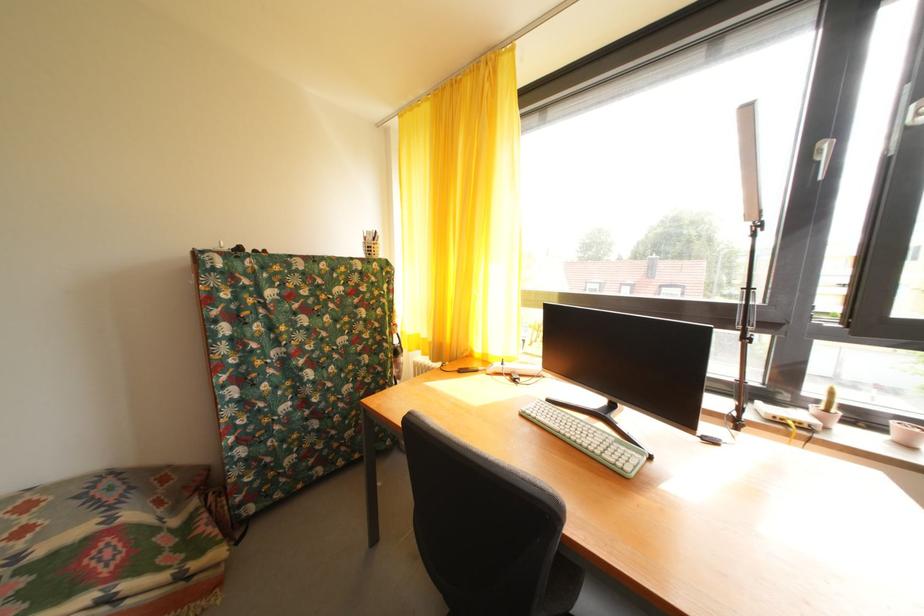
At what (x,y) coordinates should I click in order to perform the action: click on white router. Please return your answer as a coordinate pair (x, y). The width and height of the screenshot is (924, 616). Looking at the image, I should click on (786, 415).